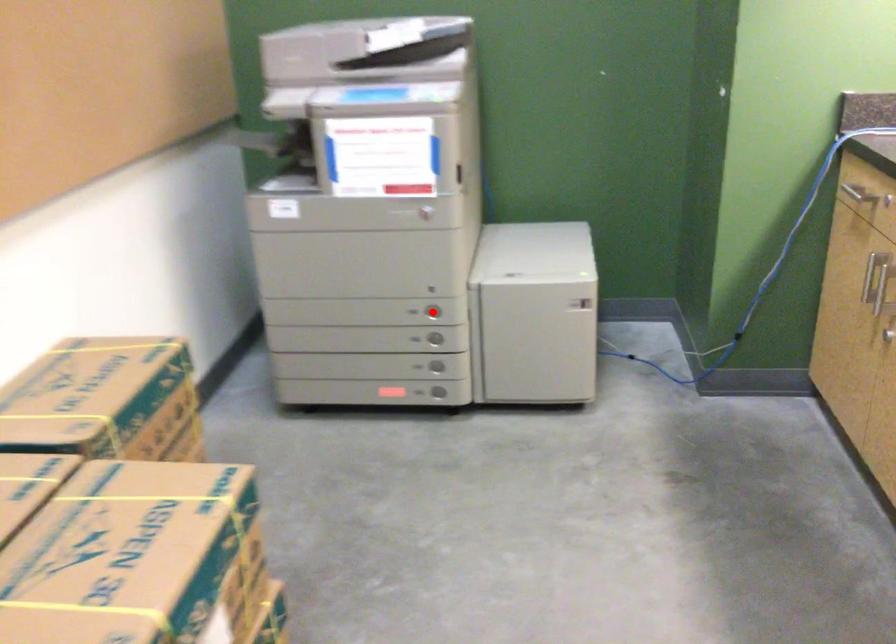
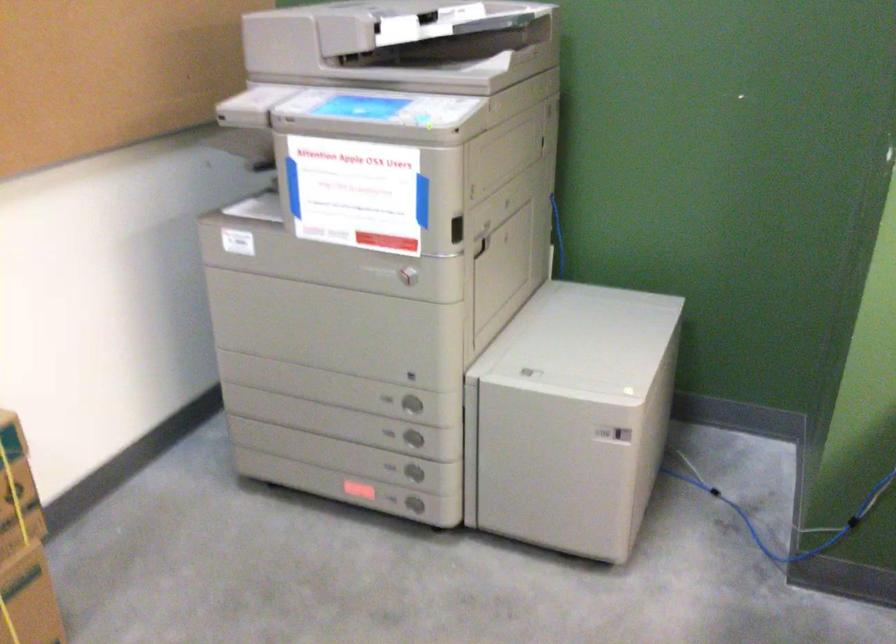
Find the pixel in the second image that matches the highlighted location in the first image.

(411, 404)